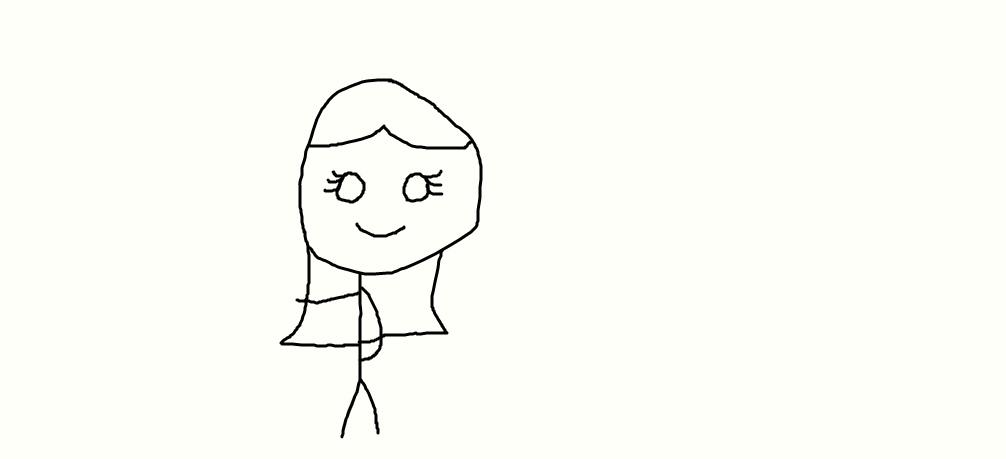
Locate an element on the screen. This screenshot has height=459, width=1006. curved arm is located at coordinates (375, 310).